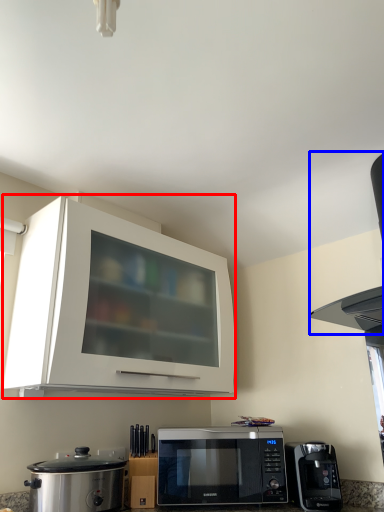
Question: Which object appears farthest to the camera in this image, cabinetry (highlighted by a red box) or vent (highlighted by a blue box)?

Choices:
 (A) cabinetry
 (B) vent

Answer: (A)